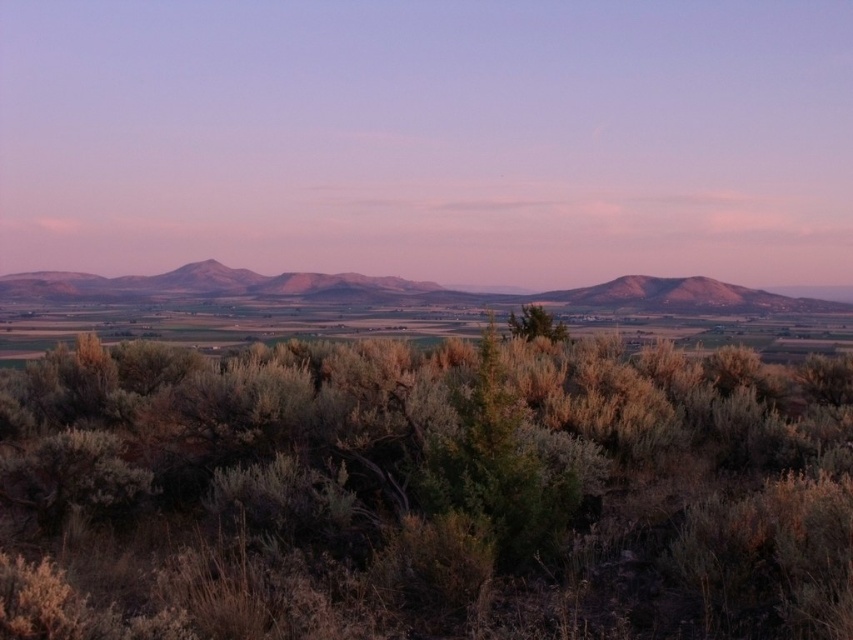
The height and width of the screenshot is (640, 853). I want to click on green shrubbery at center, so click(424, 492).

Describe the element at coordinates (424, 492) in the screenshot. This screenshot has width=853, height=640. I see `green shrubbery at center` at that location.

Where is `green shrubbery at center`? The image size is (853, 640). green shrubbery at center is located at coordinates (424, 492).

Does rustic brown mountains at center have a larger size compared to green leafy bush at center?

A: Yes, rustic brown mountains at center is bigger than green leafy bush at center.

Between point (730, 310) and point (561, 330), which one is positioned in front?

Point (561, 330) is more forward.

This screenshot has width=853, height=640. Find the location of `rustic brown mountains at center`. rustic brown mountains at center is located at coordinates (397, 289).

Measure the distance between green shrubbery at center and camera.

5.80 meters

Is point (735, 595) farther from viewer compared to point (544, 330)?

No.

Where is `green shrubbery at center`? green shrubbery at center is located at coordinates (424, 492).